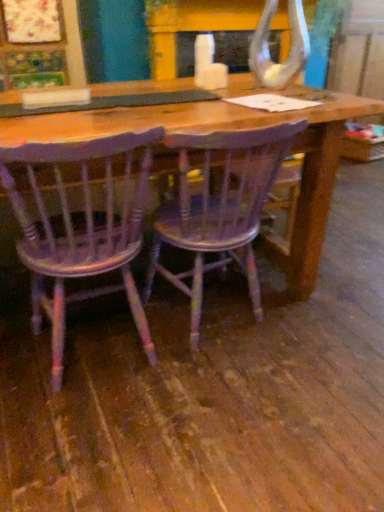
Image resolution: width=384 pixels, height=512 pixels. I want to click on distressed purple wood chair at center, positioned as the 2th chair in right-to-left order, so click(x=81, y=231).

This screenshot has height=512, width=384. What do you see at coordinates (81, 231) in the screenshot? I see `distressed purple wood chair at center, acting as the first chair starting from the left` at bounding box center [81, 231].

Image resolution: width=384 pixels, height=512 pixels. Describe the element at coordinates (219, 207) in the screenshot. I see `wooden chair at center, the 1th chair when ordered from right to left` at that location.

Find the location of a particular element. The width and height of the screenshot is (384, 512). wooden chair at center, the second chair from the left is located at coordinates (219, 207).

Based on the photo, what is the approximate height of wooden chair at center, the second chair from the left?

The height of wooden chair at center, the second chair from the left, is 80.78 centimeters.

Locate an element on the screen. distressed purple wood chair at center, acting as the first chair starting from the left is located at coordinates (81, 231).

Is distressed purple wood chair at center, acting as the first chair starting from the left, to the left or to the right of wooden chair at center, the 1th chair when ordered from right to left, in the image?

distressed purple wood chair at center, acting as the first chair starting from the left, is positioned on wooden chair at center, the 1th chair when ordered from right to left,'s left side.

Who is more distant, distressed purple wood chair at center, positioned as the 2th chair in right-to-left order, or wooden chair at center, the 1th chair when ordered from right to left?

Positioned behind is wooden chair at center, the 1th chair when ordered from right to left.

Between point (28, 243) and point (253, 186), which one is positioned behind?

The point (253, 186) is farther from the camera.

From the image's perspective, who appears lower, distressed purple wood chair at center, acting as the first chair starting from the left, or wooden chair at center, the 1th chair when ordered from right to left?

distressed purple wood chair at center, acting as the first chair starting from the left.

From a real-world perspective, is distressed purple wood chair at center, acting as the first chair starting from the left, positioned above or below wooden chair at center, the second chair from the left?

distressed purple wood chair at center, acting as the first chair starting from the left, is above wooden chair at center, the second chair from the left.

Considering the sizes of objects distressed purple wood chair at center, positioned as the 2th chair in right-to-left order, and wooden chair at center, the second chair from the left, in the image provided, who is thinner, distressed purple wood chair at center, positioned as the 2th chair in right-to-left order, or wooden chair at center, the second chair from the left,?

distressed purple wood chair at center, positioned as the 2th chair in right-to-left order.

Who is shorter, distressed purple wood chair at center, positioned as the 2th chair in right-to-left order, or wooden chair at center, the second chair from the left?

wooden chair at center, the second chair from the left.

Who is smaller, distressed purple wood chair at center, positioned as the 2th chair in right-to-left order, or wooden chair at center, the 1th chair when ordered from right to left?

With smaller size is distressed purple wood chair at center, positioned as the 2th chair in right-to-left order.

Could wooden chair at center, the second chair from the left, be considered to be inside distressed purple wood chair at center, acting as the first chair starting from the left?

No, wooden chair at center, the second chair from the left, is not surrounded by distressed purple wood chair at center, acting as the first chair starting from the left.

Is there a large distance between distressed purple wood chair at center, acting as the first chair starting from the left, and wooden chair at center, the 1th chair when ordered from right to left?

No, distressed purple wood chair at center, acting as the first chair starting from the left, is in close proximity to wooden chair at center, the 1th chair when ordered from right to left.

Is distressed purple wood chair at center, positioned as the 2th chair in right-to-left order, facing away from wooden chair at center, the second chair from the left?

distressed purple wood chair at center, positioned as the 2th chair in right-to-left order, is not turned away from wooden chair at center, the second chair from the left.

Consider the image. How many degrees apart are the facing directions of distressed purple wood chair at center, positioned as the 2th chair in right-to-left order, and wooden chair at center, the second chair from the left?

There is a 1.33-degree angle between the facing directions of distressed purple wood chair at center, positioned as the 2th chair in right-to-left order, and wooden chair at center, the second chair from the left.

Image resolution: width=384 pixels, height=512 pixels. Identify the location of chair that is above the wooden chair at center, the second chair from the left (from a real-world perspective). (81, 231).

Considering the positions of objects wooden chair at center, the 1th chair when ordered from right to left, and distressed purple wood chair at center, positioned as the 2th chair in right-to-left order, in the image provided, who is more to the right, wooden chair at center, the 1th chair when ordered from right to left, or distressed purple wood chair at center, positioned as the 2th chair in right-to-left order,?

Positioned to the right is wooden chair at center, the 1th chair when ordered from right to left.

Is the position of wooden chair at center, the 1th chair when ordered from right to left, less distant than that of distressed purple wood chair at center, positioned as the 2th chair in right-to-left order?

No, wooden chair at center, the 1th chair when ordered from right to left, is further to the viewer.

Is point (236, 210) closer or farther from the camera than point (91, 248)?

Point (236, 210) is positioned farther from the camera compared to point (91, 248).

From the image's perspective, is wooden chair at center, the second chair from the left, positioned above or below distressed purple wood chair at center, acting as the first chair starting from the left?

wooden chair at center, the second chair from the left, is situated higher than distressed purple wood chair at center, acting as the first chair starting from the left, in the image.

From a real-world perspective, is wooden chair at center, the second chair from the left, under distressed purple wood chair at center, acting as the first chair starting from the left?

Correct, in the physical world, wooden chair at center, the second chair from the left, is lower than distressed purple wood chair at center, acting as the first chair starting from the left.

Is wooden chair at center, the second chair from the left, wider than distressed purple wood chair at center, acting as the first chair starting from the left?

Yes, wooden chair at center, the second chair from the left, is wider than distressed purple wood chair at center, acting as the first chair starting from the left.

Does wooden chair at center, the second chair from the left, have a greater height compared to distressed purple wood chair at center, positioned as the 2th chair in right-to-left order?

No, wooden chair at center, the second chair from the left, is not taller than distressed purple wood chair at center, positioned as the 2th chair in right-to-left order.

Considering the sizes of wooden chair at center, the second chair from the left, and distressed purple wood chair at center, positioned as the 2th chair in right-to-left order, in the image, is wooden chair at center, the second chair from the left, bigger or smaller than distressed purple wood chair at center, positioned as the 2th chair in right-to-left order,?

Clearly, wooden chair at center, the second chair from the left, is larger in size than distressed purple wood chair at center, positioned as the 2th chair in right-to-left order.

Choose the correct answer: Is wooden chair at center, the 1th chair when ordered from right to left, inside distressed purple wood chair at center, acting as the first chair starting from the left, or outside it?

wooden chair at center, the 1th chair when ordered from right to left, is spatially situated outside distressed purple wood chair at center, acting as the first chair starting from the left.

Are wooden chair at center, the 1th chair when ordered from right to left, and distressed purple wood chair at center, positioned as the 2th chair in right-to-left order, making contact?

No, wooden chair at center, the 1th chair when ordered from right to left, is not making contact with distressed purple wood chair at center, positioned as the 2th chair in right-to-left order.

Is wooden chair at center, the second chair from the left, turned away from distressed purple wood chair at center, positioned as the 2th chair in right-to-left order?

No, wooden chair at center, the second chair from the left, is not facing away from distressed purple wood chair at center, positioned as the 2th chair in right-to-left order.

Where is `chair below the distressed purple wood chair at center, acting as the first chair starting from the left (from a real-world perspective)`? This screenshot has width=384, height=512. chair below the distressed purple wood chair at center, acting as the first chair starting from the left (from a real-world perspective) is located at coordinates (219, 207).

Locate an element on the screen. The image size is (384, 512). chair in front of the wooden chair at center, the second chair from the left is located at coordinates (81, 231).

At what (x,y) coordinates should I click in order to perform the action: click on chair that appears below the distressed purple wood chair at center, positioned as the 2th chair in right-to-left order (from a real-world perspective). Please return your answer as a coordinate pair (x, y). This screenshot has width=384, height=512. Looking at the image, I should click on (219, 207).